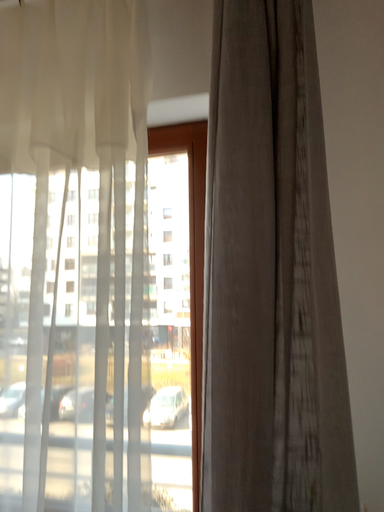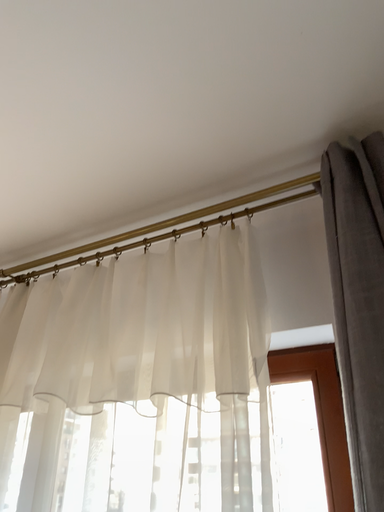
Question: Which way did the camera rotate in the video?

Choices:
 (A) rotated upward
 (B) rotated downward

Answer: (A)